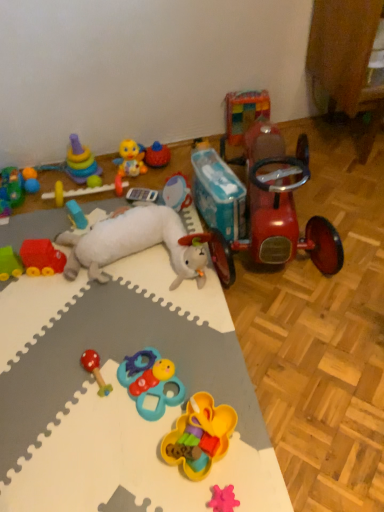
Locate an element on the screen. The image size is (384, 512). vacant area that is in front of rubberized yellow flower-shaped toy at center, the tenth toy in the left-to-right sequence is located at coordinates (219, 484).